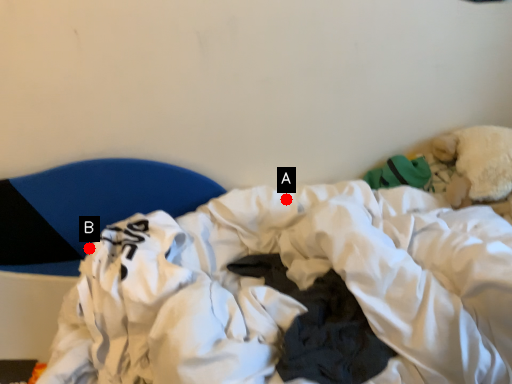
Question: Two points are circled on the image, labeled by A and B beside each circle. Which point appears farthest from the camera in this image?

Choices:
 (A) A is further
 (B) B is further

Answer: (B)